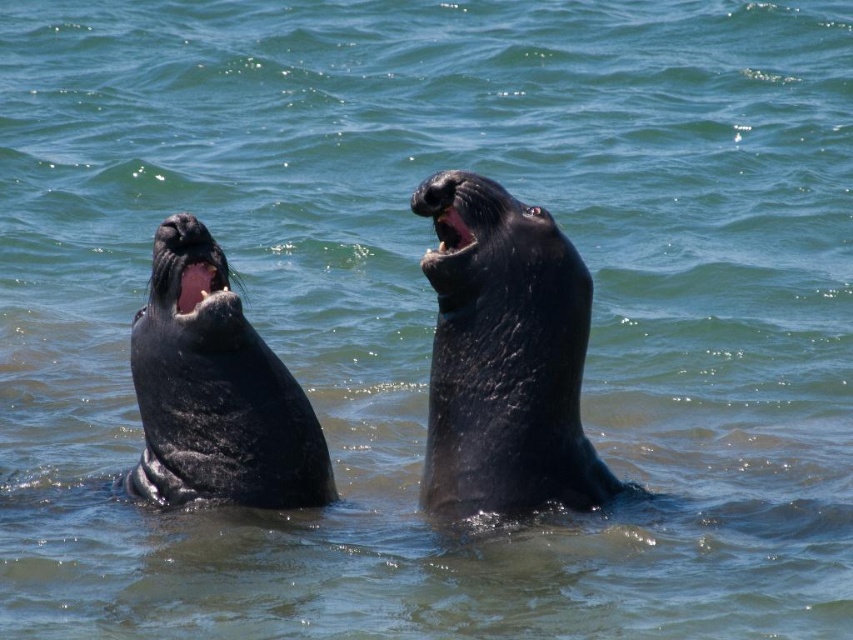
Which is more to the right, shiny black seal at center or black matte seal mouth at upper center?

From the viewer's perspective, shiny black seal at center appears more on the right side.

Is shiny black seal at center taller than black matte seal mouth at upper center?

Indeed, shiny black seal at center has a greater height compared to black matte seal mouth at upper center.

This screenshot has width=853, height=640. Find the location of `shiny black seal at center`. shiny black seal at center is located at coordinates [x=505, y=358].

Does shiny black seal at left lie behind black matte seal mouth at upper center?

No, shiny black seal at left is in front of black matte seal mouth at upper center.

Based on the photo, between shiny black seal at left and black matte seal mouth at upper center, which one has more height?

Standing taller between the two is shiny black seal at left.

Is point (227, 372) closer to viewer compared to point (461, 224)?

No, (227, 372) is behind (461, 224).

This screenshot has height=640, width=853. Identify the location of shiny black seal at left. pos(215,390).

Which is in front, point (546, 374) or point (149, 305)?

Positioned in front is point (546, 374).

Which of these two, shiny black seal at center or shiny black seal at left, stands shorter?

shiny black seal at left is shorter.

Which is in front, point (434, 228) or point (171, 426)?

Point (434, 228)

You are a GUI agent. You are given a task and a screenshot of the screen. Output one action in this format:
    pyautogui.click(x=<x>, y=<y>)
    Task: Click on the shiny black seal at center
    The width and height of the screenshot is (853, 640).
    Given the screenshot: What is the action you would take?
    pyautogui.click(x=505, y=358)